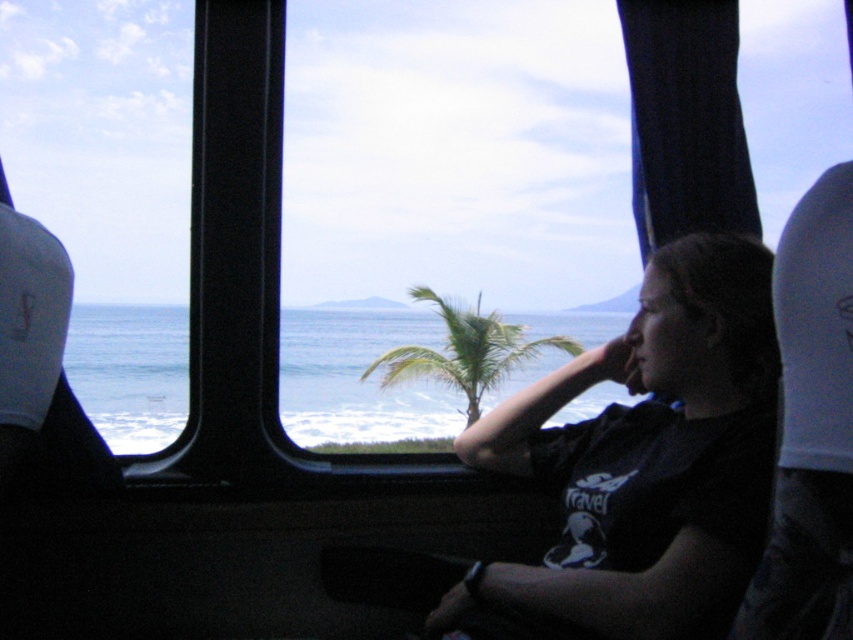
You are a passenger sitting in the front seat of a vehicle. You notice the transparent glass window at center and the green leafy palm tree at center. Which object takes up more space in your view?

The transparent glass window at center is bigger than the green leafy palm tree at center, so it takes up more space in your view.

You are a passenger sitting in the front seat of the vehicle. You want to see the palm tree outside through the window. Can you see the entire green leafy palm tree at center through the transparent glass window at left?

The transparent glass window at left is taller than green leafy palm tree at center, so yes, you can see the entire green leafy palm tree at center through the transparent glass window at left because the window is taller than the tree.